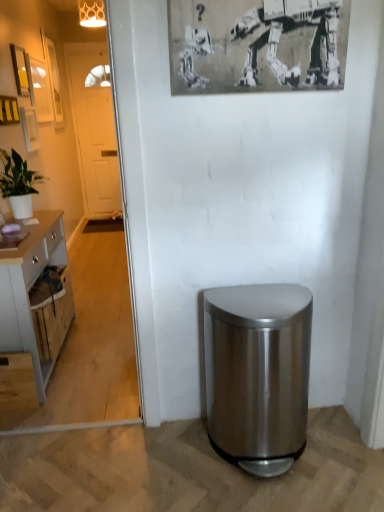
Question: Can you confirm if wooden picture frame at upper left, the second picture frame when ordered from front to back, is smaller than green matte plant at left?

Choices:
 (A) no
 (B) yes

Answer: (B)

Question: Is wooden picture frame at upper left, the fifth picture frame when ordered from left to right, taller than green matte plant at left?

Choices:
 (A) yes
 (B) no

Answer: (B)

Question: From a real-world perspective, is wooden picture frame at upper left, the second picture frame from the right, over green matte plant at left?

Choices:
 (A) no
 (B) yes

Answer: (B)

Question: From the image's perspective, does wooden picture frame at upper left, the second picture frame from the right, appear higher than green matte plant at left?

Choices:
 (A) yes
 (B) no

Answer: (A)

Question: Is wooden picture frame at upper left, the fifth picture frame when ordered from left to right, placed right next to green matte plant at left?

Choices:
 (A) yes
 (B) no

Answer: (B)

Question: Considering the relative sizes of wooden picture frame at upper left, marked as the 5th picture frame in a back-to-front arrangement, and green matte plant at left in the image provided, is wooden picture frame at upper left, marked as the 5th picture frame in a back-to-front arrangement, thinner than green matte plant at left?

Choices:
 (A) no
 (B) yes

Answer: (B)

Question: Would you say wooden picture frame at upper left, which is the 6th picture frame from front to back, is part of matte black picture frame at upper left, placed as the fourth picture frame when sorted from back to front,'s contents?

Choices:
 (A) yes
 (B) no

Answer: (B)

Question: Can you confirm if matte black picture frame at upper left, arranged as the 4th picture frame when viewed from the right, is smaller than wooden picture frame at upper left, marked as the 1th picture frame in a left-to-right arrangement?

Choices:
 (A) yes
 (B) no

Answer: (A)

Question: Is matte black picture frame at upper left, placed as the fourth picture frame when sorted from back to front, to the right of wooden picture frame at upper left, which is the 6th picture frame from front to back, from the viewer's perspective?

Choices:
 (A) no
 (B) yes

Answer: (B)

Question: Could you tell me if matte black picture frame at upper left, acting as the 3th picture frame starting from the left, is facing wooden picture frame at upper left, marked as the 1th picture frame in a left-to-right arrangement?

Choices:
 (A) no
 (B) yes

Answer: (A)

Question: From a real-world perspective, is matte black picture frame at upper left, arranged as the 4th picture frame when viewed from the right, under wooden picture frame at upper left, marked as the 1th picture frame in a left-to-right arrangement?

Choices:
 (A) no
 (B) yes

Answer: (A)

Question: Can you confirm if matte black picture frame at upper left, the third picture frame positioned from the front, is shorter than wooden picture frame at upper left, acting as the 1th picture frame starting from the back?

Choices:
 (A) no
 (B) yes

Answer: (B)

Question: Is matte white picture frame at upper left, which is the fourth picture frame from left to right, completely or partially inside wooden picture frame at upper left, which is the 6th picture frame from front to back?

Choices:
 (A) yes
 (B) no

Answer: (B)